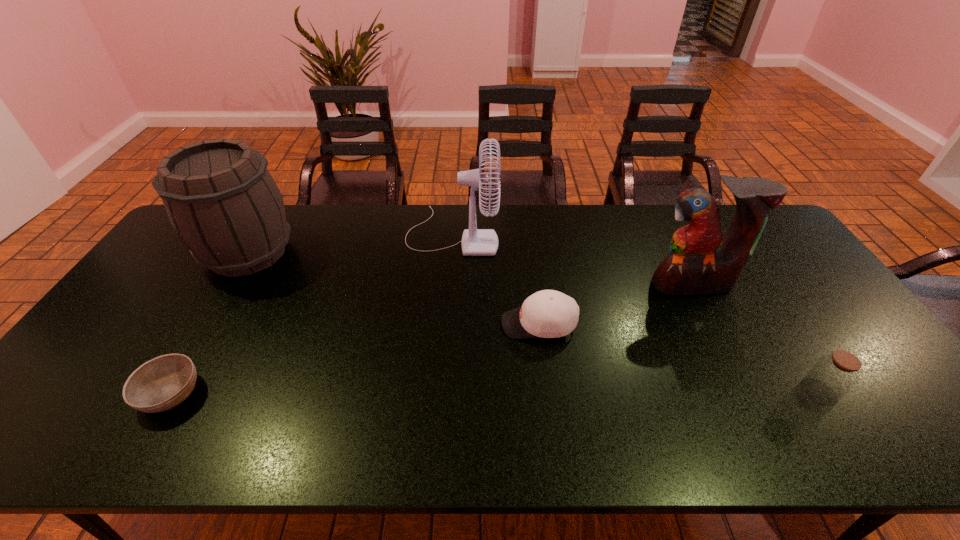
Locate an element on the screen. vacant area between the rightmost object and the parrot is located at coordinates (756, 338).

Find the location of a particular element. free area in between the wine bucket and the fan is located at coordinates [x=350, y=243].

You are a GUI agent. You are given a task and a screenshot of the screen. Output one action in this format:
    pyautogui.click(x=<x>, y=<y>)
    Task: Click on the empty space that is in between the wine bucket and the fan
    
    Given the screenshot: What is the action you would take?
    pyautogui.click(x=350, y=243)

Identify the location of blank region between the fifth object from left to right and the wine bucket. This screenshot has height=540, width=960. (470, 268).

Where is `free space between the wine bucket and the parrot`? This screenshot has width=960, height=540. free space between the wine bucket and the parrot is located at coordinates (470, 268).

You are a GUI agent. You are given a task and a screenshot of the screen. Output one action in this format:
    pyautogui.click(x=<x>, y=<y>)
    Task: Click on the blank region between the fan and the third nearest object
    Image resolution: width=960 pixels, height=540 pixels.
    Given the screenshot: What is the action you would take?
    pyautogui.click(x=495, y=279)

Locate which object ranks second in proximity to the fan. Please provide its 2D coordinates. Your answer should be formatted as a tuple, i.e. [(x, y)], where the tuple contains the x and y coordinates of a point satisfying the conditions above.

[(220, 198)]

The width and height of the screenshot is (960, 540). In order to click on object that stands as the closest to the third shortest object in this screenshot , I will do coord(702,261).

Find the location of a particular element. The height and width of the screenshot is (540, 960). blank area in the image that satisfies the following two spatial constraints: 1. at the face of the parrot; 2. on the front-facing side of the baseball cap is located at coordinates (712, 324).

In order to click on free location that satisfies the following two spatial constraints: 1. at the face of the parrot; 2. on the front-facing side of the baseball cap in this screenshot , I will do `click(712, 324)`.